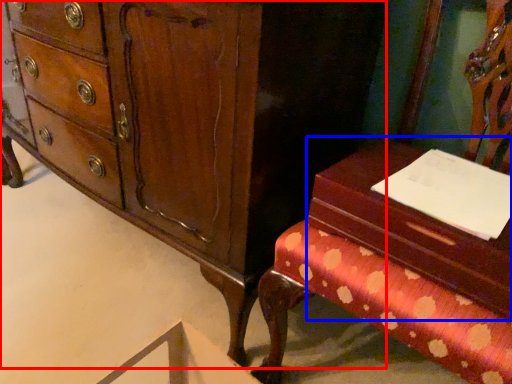
Question: Among these objects, which one is nearest to the camera, chest of drawers (highlighted by a red box) or vanity (highlighted by a blue box)?

Choices:
 (A) chest of drawers
 (B) vanity

Answer: (B)